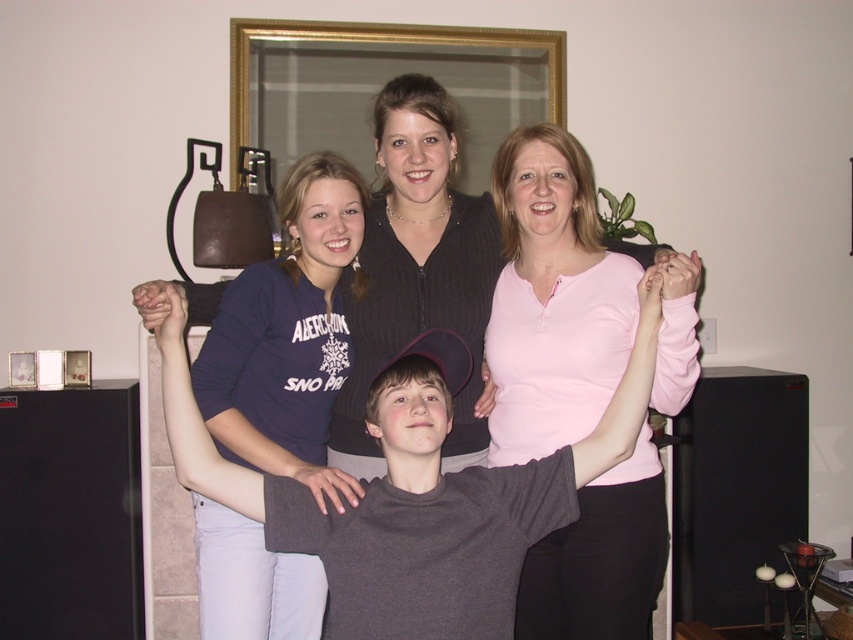
Between point (274, 518) and point (264, 348), which one is positioned in front?

Point (274, 518) is more forward.

Does dark gray cotton shirt at center appear under dark blue jersey at center?

Yes, dark gray cotton shirt at center is below dark blue jersey at center.

The image size is (853, 640). What do you see at coordinates (416, 497) in the screenshot? I see `dark gray cotton shirt at center` at bounding box center [416, 497].

You are a GUI agent. You are given a task and a screenshot of the screen. Output one action in this format:
    pyautogui.click(x=<x>, y=<y>)
    Task: Click on the dark gray cotton shirt at center
    
    Given the screenshot: What is the action you would take?
    pyautogui.click(x=416, y=497)

Is point (689, 273) closer to camera compared to point (192, 488)?

No, (689, 273) is behind (192, 488).

Who is shorter, pink soft fabric shirt at upper center or dark gray cotton shirt at center?

With less height is dark gray cotton shirt at center.

This screenshot has height=640, width=853. Find the location of `pink soft fabric shirt at upper center`. pink soft fabric shirt at upper center is located at coordinates (553, 300).

Between point (505, 316) and point (341, 214), which one is positioned behind?

Positioned behind is point (505, 316).

From the picture: Is pink soft fabric shirt at upper center above dark blue jersey at center?

Indeed, pink soft fabric shirt at upper center is positioned over dark blue jersey at center.

In order to click on pink soft fabric shirt at upper center in this screenshot , I will do `click(553, 300)`.